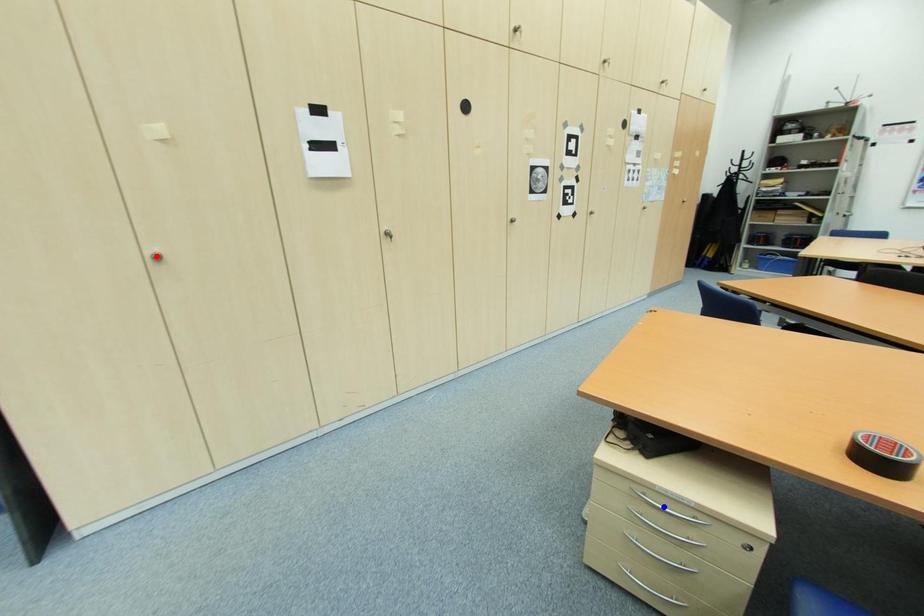
Question: Which of the two points in the image is closer to the camera?

Choices:
 (A) Blue point is closer.
 (B) Red point is closer.

Answer: (A)